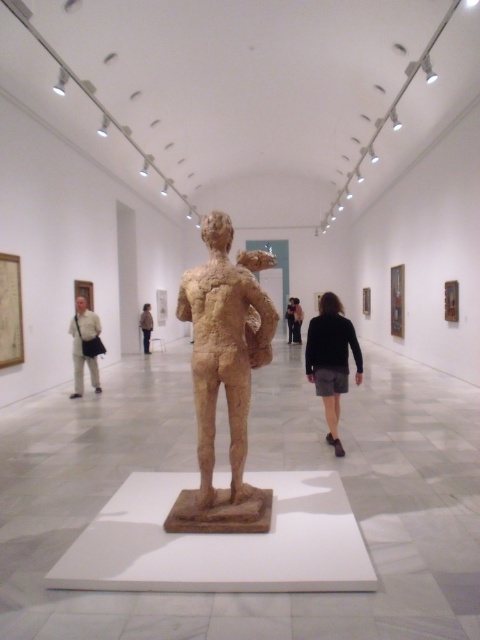
Question: Which object is closer to the camera taking this photo?

Choices:
 (A) dark gray fabric skirt at center
 (B) light beige pants at left

Answer: (A)

Question: Estimate the real-world distances between objects in this image. Which object is farther from the light beige pants at left?

Choices:
 (A) light brown textured sculpture at center
 (B) brown clay figure at center

Answer: (A)

Question: Which of the following is the closest to the observer?

Choices:
 (A) click(144, 336)
 (B) click(193, 381)

Answer: (B)

Question: Does brown clay figure at center appear over dark gray fabric skirt at center?

Choices:
 (A) no
 (B) yes

Answer: (B)

Question: Can you confirm if brown clay figure at center is wider than light brown textured sculpture at center?

Choices:
 (A) no
 (B) yes

Answer: (B)

Question: Can you confirm if light beige pants at left is positioned to the left of light brown textured sculpture at center?

Choices:
 (A) no
 (B) yes

Answer: (A)